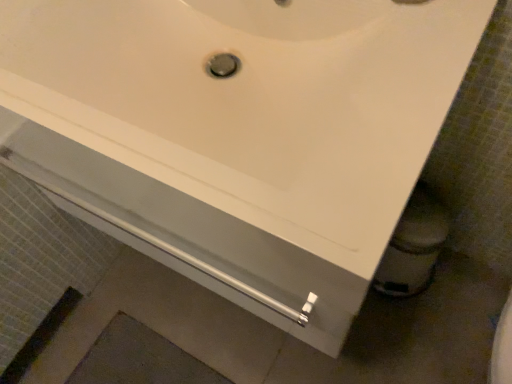
The image size is (512, 384). What do you see at coordinates (241, 118) in the screenshot? I see `white glossy sink at center` at bounding box center [241, 118].

Identify the location of white glossy sink at center. This screenshot has height=384, width=512. (241, 118).

The height and width of the screenshot is (384, 512). I want to click on white glossy sink at center, so click(241, 118).